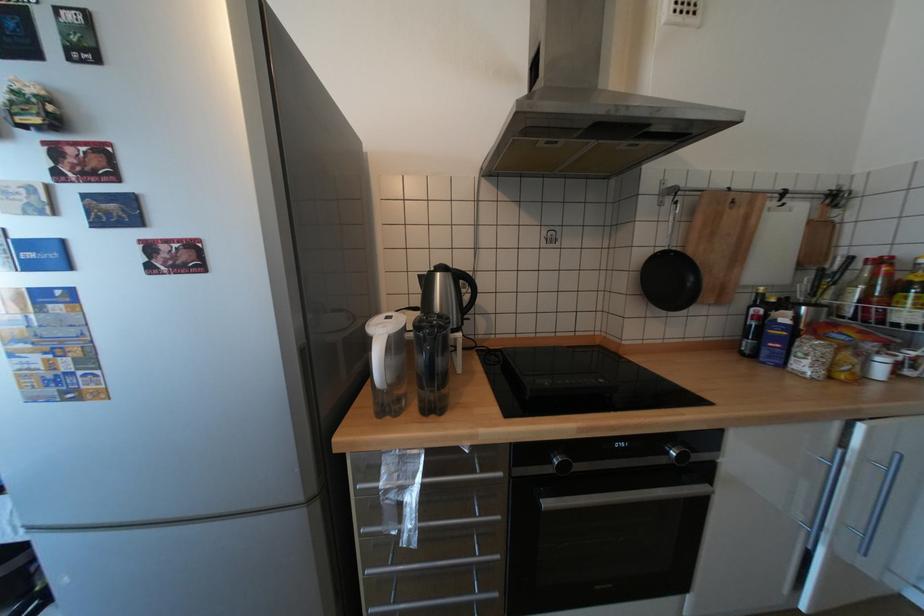
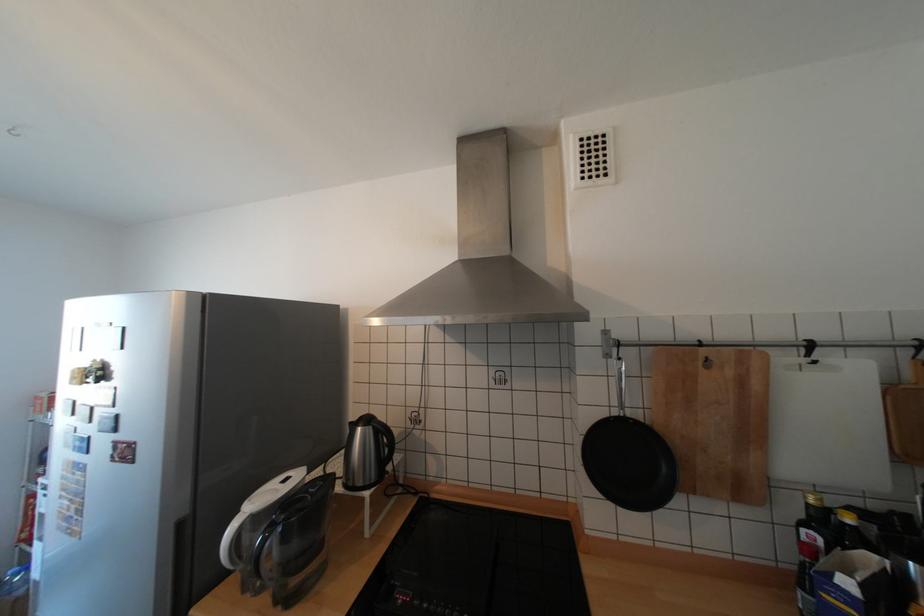
Question: What movement of the cameraman would produce the second image?

Choices:
 (A) Left
 (B) Right
 (C) Forward
 (D) Backward

Answer: (B)